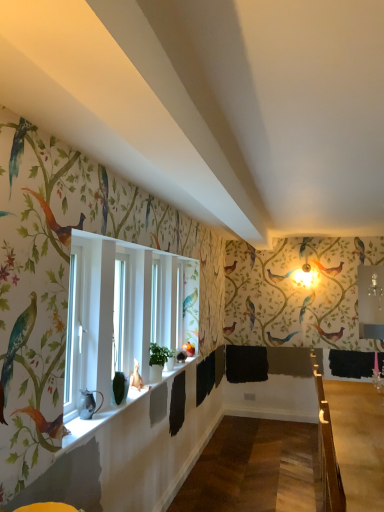
Question: Considering their positions, is white glossy window sill at lower center located in front of or behind wooden at right?

Choices:
 (A) front
 (B) behind

Answer: (A)

Question: Is white glossy window sill at lower center taller or shorter than wooden at right?

Choices:
 (A) tall
 (B) short

Answer: (B)

Question: Based on their relative distances, which object is nearer to the white glossy window sill at lower center?

Choices:
 (A) wooden at right
 (B) matte black pitcher at window

Answer: (B)

Question: Considering the real-world distances, which object is closest to the white glossy window sill at lower center?

Choices:
 (A) matte black pitcher at window
 (B) wooden at right

Answer: (A)